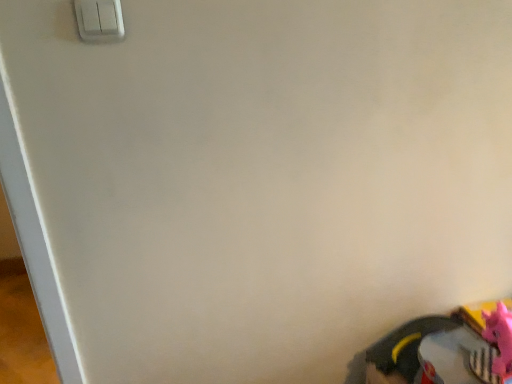
What is the approximate width of white plastic light switch at upper left?

white plastic light switch at upper left is 0.93 inches in width.

I want to click on white plastic light switch at upper left, so click(x=99, y=20).

In order to face pink rubber toy at lower right, should I rotate leftwards or rightwards?

It's best to rotate right around 33.874 degrees.

The width and height of the screenshot is (512, 384). What do you see at coordinates (404, 350) in the screenshot?
I see `rubberized black shoe at lower right` at bounding box center [404, 350].

Identify the location of white plastic light switch at upper left. (99, 20).

Can you confirm if pink rubber toy at lower right is bigger than white plastic light switch at upper left?

Indeed, pink rubber toy at lower right has a larger size compared to white plastic light switch at upper left.

Is pink rubber toy at lower right oriented towards white plastic light switch at upper left?

No, pink rubber toy at lower right is not turned towards white plastic light switch at upper left.

From the image's perspective, is pink rubber toy at lower right under white plastic light switch at upper left?

Yes, from the image's perspective, pink rubber toy at lower right is beneath white plastic light switch at upper left.

From a real-world perspective, is rubberized black shoe at lower right positioned above or below white plastic light switch at upper left?

Clearly, from a real-world perspective, rubberized black shoe at lower right is below white plastic light switch at upper left.

Is rubberized black shoe at lower right situated inside white plastic light switch at upper left or outside?

The correct answer is: outside.

Is rubberized black shoe at lower right taller than white plastic light switch at upper left?

Correct, rubberized black shoe at lower right is much taller as white plastic light switch at upper left.

In the scene shown: Is rubberized black shoe at lower right next to pink rubber toy at lower right?

No, rubberized black shoe at lower right is not touching pink rubber toy at lower right.

Could you tell me if rubberized black shoe at lower right is turned towards pink rubber toy at lower right?

No, rubberized black shoe at lower right is not facing towards pink rubber toy at lower right.

Is rubberized black shoe at lower right wider or thinner than pink rubber toy at lower right?

rubberized black shoe at lower right is thinner than pink rubber toy at lower right.

From a real-world perspective, which is physically above, rubberized black shoe at lower right or pink rubber toy at lower right?

From a 3D spatial view, pink rubber toy at lower right is above.

How different are the orientations of white plastic light switch at upper left and rubberized black shoe at lower right in degrees?

They differ by 3.45 degrees in their facing directions.

Considering the sizes of objects white plastic light switch at upper left and rubberized black shoe at lower right in the image provided, who is bigger, white plastic light switch at upper left or rubberized black shoe at lower right?

rubberized black shoe at lower right.

Are white plastic light switch at upper left and rubberized black shoe at lower right far apart?

Absolutely, white plastic light switch at upper left is distant from rubberized black shoe at lower right.

Relative to rubberized black shoe at lower right, is white plastic light switch at upper left in front or behind?

white plastic light switch at upper left is positioned closer to the viewer than rubberized black shoe at lower right.

Which object is wider, white plastic light switch at upper left or pink rubber toy at lower right?

With larger width is pink rubber toy at lower right.

From the image's perspective, between white plastic light switch at upper left and pink rubber toy at lower right, which one is located above?

white plastic light switch at upper left.

Do you think white plastic light switch at upper left is within pink rubber toy at lower right, or outside of it?

The correct answer is: outside.

How many degrees apart are the facing directions of pink rubber toy at lower right and rubberized black shoe at lower right?

The facing directions of pink rubber toy at lower right and rubberized black shoe at lower right are 35.2 degrees apart.

Who is smaller, pink rubber toy at lower right or rubberized black shoe at lower right?

Smaller between the two is pink rubber toy at lower right.

From the image's perspective, is pink rubber toy at lower right positioned above or below rubberized black shoe at lower right?

From the image's perspective, pink rubber toy at lower right appears above rubberized black shoe at lower right.

The height and width of the screenshot is (384, 512). In order to click on toy located on the right of rubberized black shoe at lower right in this screenshot , I will do `click(500, 338)`.

Find the location of a particular element. The image size is (512, 384). toy below the white plastic light switch at upper left (from the image's perspective) is located at coordinates (500, 338).

In order to click on light switch that appears in front of the rubberized black shoe at lower right in this screenshot , I will do `click(99, 20)`.

Estimate the real-world distances between objects in this image. Which object is closer to pink rubber toy at lower right, white plastic light switch at upper left or rubberized black shoe at lower right?

Among the two, rubberized black shoe at lower right is located nearer to pink rubber toy at lower right.

Based on their spatial positions, is rubberized black shoe at lower right or white plastic light switch at upper left further from pink rubber toy at lower right?

white plastic light switch at upper left.

Looking at the image, which one is located further to white plastic light switch at upper left, pink rubber toy at lower right or rubberized black shoe at lower right?

rubberized black shoe at lower right.

Which object lies nearer to the anchor point rubberized black shoe at lower right, white plastic light switch at upper left or pink rubber toy at lower right?

pink rubber toy at lower right lies closer to rubberized black shoe at lower right than the other object.

Considering their positions, is rubberized black shoe at lower right positioned closer to white plastic light switch at upper left than pink rubber toy at lower right?

pink rubber toy at lower right lies closer to white plastic light switch at upper left than the other object.

Considering their positions, is pink rubber toy at lower right positioned closer to rubberized black shoe at lower right than white plastic light switch at upper left?

Among the two, pink rubber toy at lower right is located nearer to rubberized black shoe at lower right.

The image size is (512, 384). I want to click on footwear between white plastic light switch at upper left and pink rubber toy at lower right, so click(404, 350).